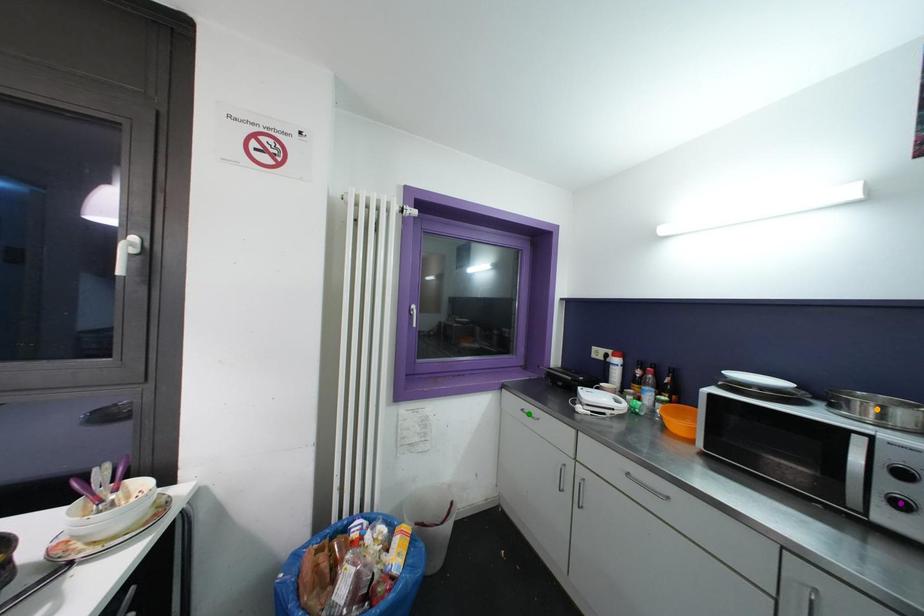
Looking at this image, order these from nearest to farthest:
A) green point
B) purple point
C) orange point

1. purple point
2. orange point
3. green point